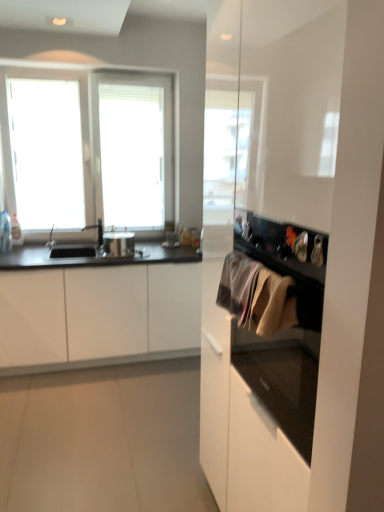
Question: Is silver metallic faucet at left shorter than textured beige towel at center right?

Choices:
 (A) no
 (B) yes

Answer: (A)

Question: Is silver metallic faucet at left aimed at textured beige towel at center right?

Choices:
 (A) no
 (B) yes

Answer: (B)

Question: Considering the relative sizes of silver metallic faucet at left and textured beige towel at center right in the image provided, is silver metallic faucet at left thinner than textured beige towel at center right?

Choices:
 (A) yes
 (B) no

Answer: (B)

Question: Is silver metallic faucet at left in front of textured beige towel at center right?

Choices:
 (A) no
 (B) yes

Answer: (A)

Question: From a real-world perspective, is silver metallic faucet at left located beneath textured beige towel at center right?

Choices:
 (A) yes
 (B) no

Answer: (A)

Question: Would you say shiny metallic pot at center is inside or outside silver metallic faucet at left?

Choices:
 (A) outside
 (B) inside

Answer: (A)

Question: In terms of size, does shiny metallic pot at center appear bigger or smaller than silver metallic faucet at left?

Choices:
 (A) small
 (B) big

Answer: (B)

Question: From their relative heights in the image, would you say shiny metallic pot at center is taller or shorter than silver metallic faucet at left?

Choices:
 (A) short
 (B) tall

Answer: (A)

Question: From a real-world perspective, is shiny metallic pot at center above or below silver metallic faucet at left?

Choices:
 (A) above
 (B) below

Answer: (B)

Question: From a real-world perspective, is white matte cabinet at left physically located above or below shiny metallic pot at center?

Choices:
 (A) below
 (B) above

Answer: (A)

Question: From their relative heights in the image, would you say white matte cabinet at left is taller or shorter than shiny metallic pot at center?

Choices:
 (A) tall
 (B) short

Answer: (A)

Question: In the image, is white matte cabinet at left on the left side or the right side of shiny metallic pot at center?

Choices:
 (A) right
 (B) left

Answer: (B)

Question: Is white matte cabinet at left wider or thinner than shiny metallic pot at center?

Choices:
 (A) thin
 (B) wide

Answer: (B)

Question: Considering the positions of textured beige towel at center right and shiny metallic pot at center in the image, is textured beige towel at center right bigger or smaller than shiny metallic pot at center?

Choices:
 (A) small
 (B) big

Answer: (A)

Question: Is point (251, 320) positioned closer to the camera than point (114, 245)?

Choices:
 (A) farther
 (B) closer

Answer: (B)